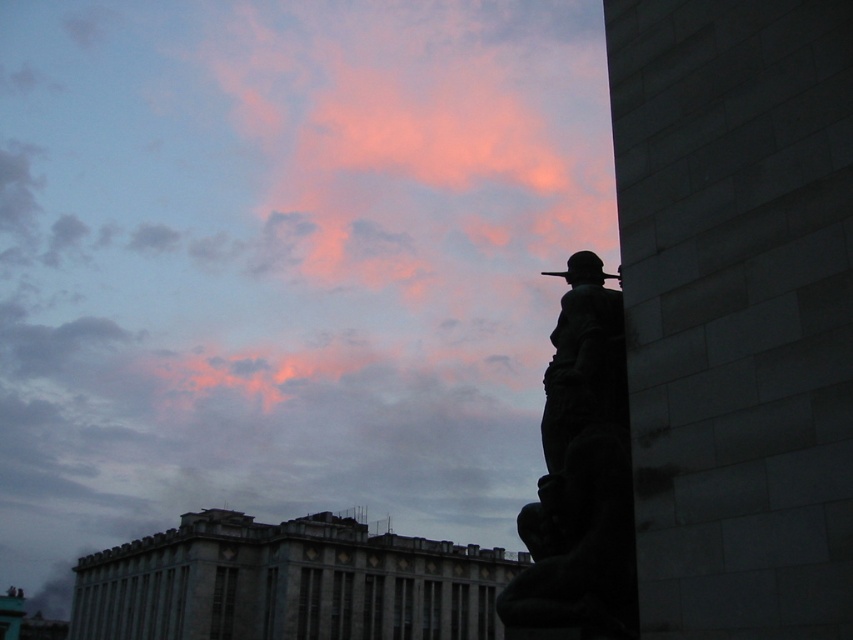
You are an artist trying to sketch the scene. You notice the pink cloud at upper center and the dark stone statue at right. Which object should you draw first if you want to capture the tallest elements first?

The pink cloud at upper center should be drawn first because it is much taller than the dark stone statue at right according to the description.

You are an astronomer observing the sky and notice the pink cloud at upper center and the dark stone statue at right. Which object is closer to the observer?

The pink cloud at upper center is closer to the observer because the dark stone statue at right is behind it.